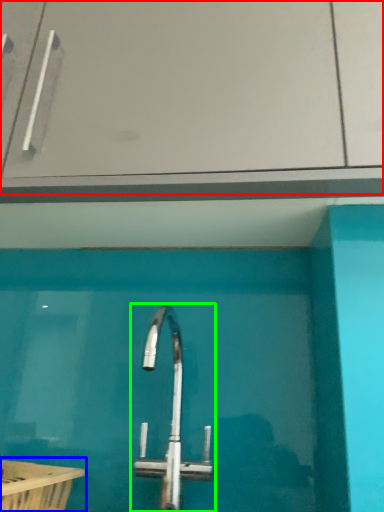
Question: Which object is positioned farthest from glass door (highlighted by a red box)? Select from bath (highlighted by a blue box) and tap (highlighted by a green box).

Choices:
 (A) bath
 (B) tap

Answer: (A)